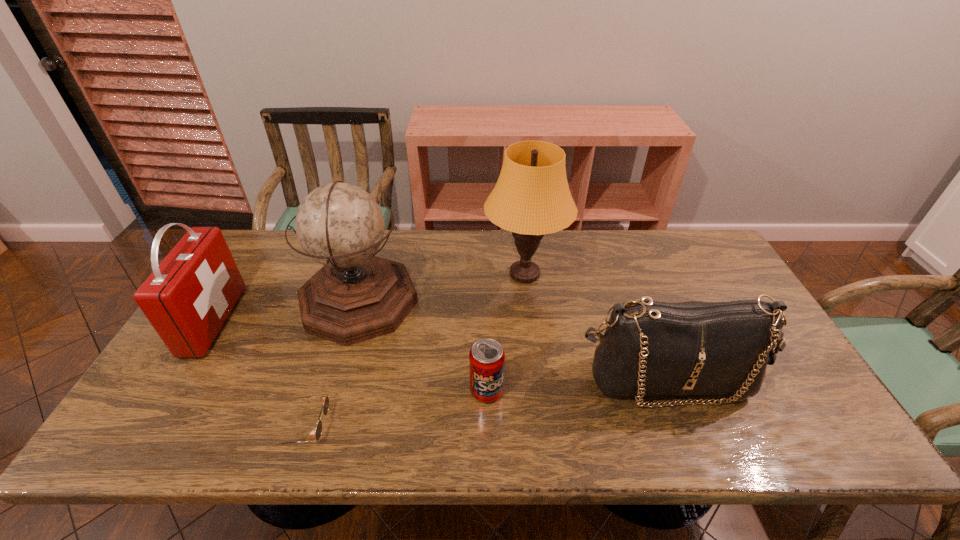
What are the coordinates of `lampshade` in the screenshot? It's located at (531, 198).

Identify the location of globe. (356, 296).

The image size is (960, 540). Find the location of `the leftmost object`. the leftmost object is located at coordinates (187, 298).

Locate an element on the screen. handbag is located at coordinates (649, 348).

Locate an element on the screen. soda can is located at coordinates (486, 358).

Locate an element on the screen. Image resolution: width=960 pixels, height=540 pixels. sunglasses is located at coordinates (325, 399).

At what (x,y) coordinates should I click in order to perform the action: click on free space located on the left of the lampshade. Please return your answer as a coordinate pair (x, y). The width and height of the screenshot is (960, 540). Looking at the image, I should click on (430, 274).

In order to click on free spot located on the surface of the globe in this screenshot , I will do `click(468, 301)`.

Locate an element on the screen. The image size is (960, 540). free space located 0.140m on the front face of the leftmost object is located at coordinates (278, 321).

Locate an element on the screen. vacant area situated 0.330m on the left of the soda can is located at coordinates (334, 391).